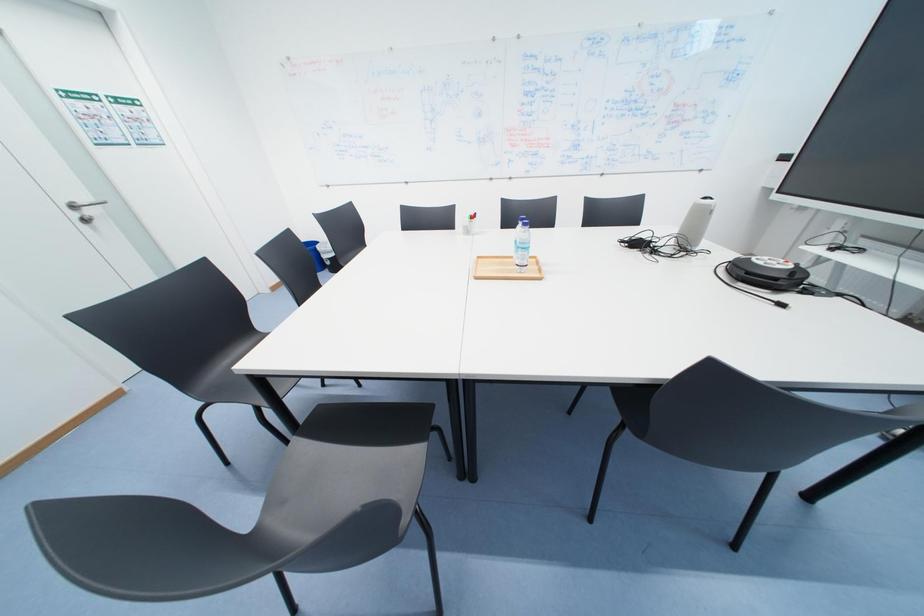
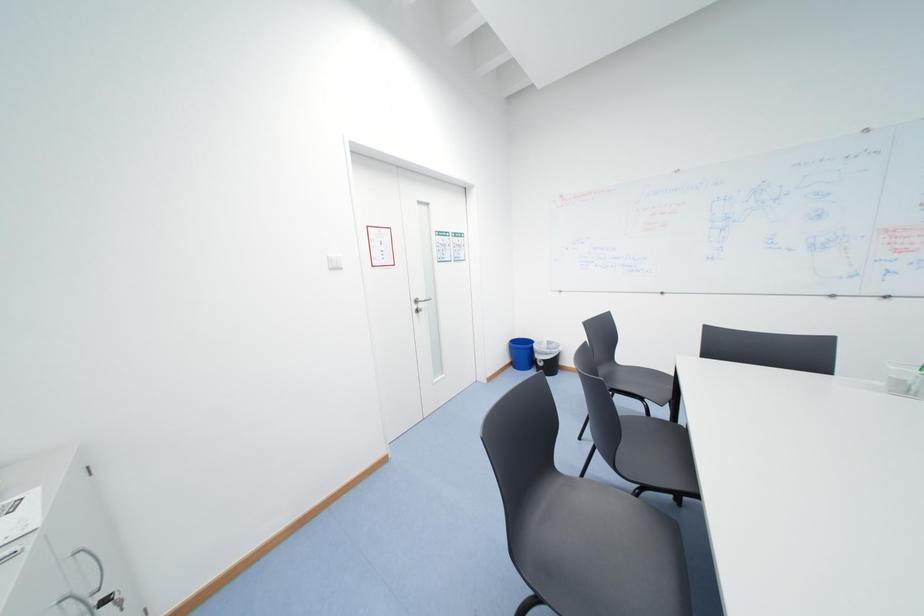
The images are taken continuously from a first-person perspective. In which direction is your viewpoint rotating?

The rotation direction of the camera is left-up.